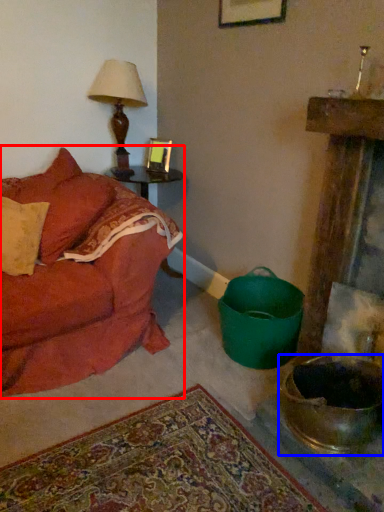
Question: Which of the following is the farthest to the observer, studio couch (highlighted by a red box) or mixing bowl (highlighted by a blue box)?

Choices:
 (A) studio couch
 (B) mixing bowl

Answer: (A)